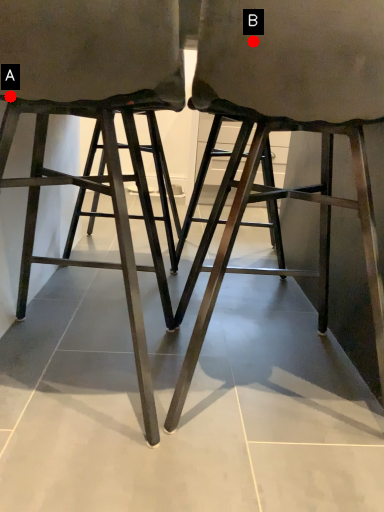
Question: Two points are circled on the image, labeled by A and B beside each circle. Which point is closer to the camera taking this photo?

Choices:
 (A) A is closer
 (B) B is closer

Answer: (B)